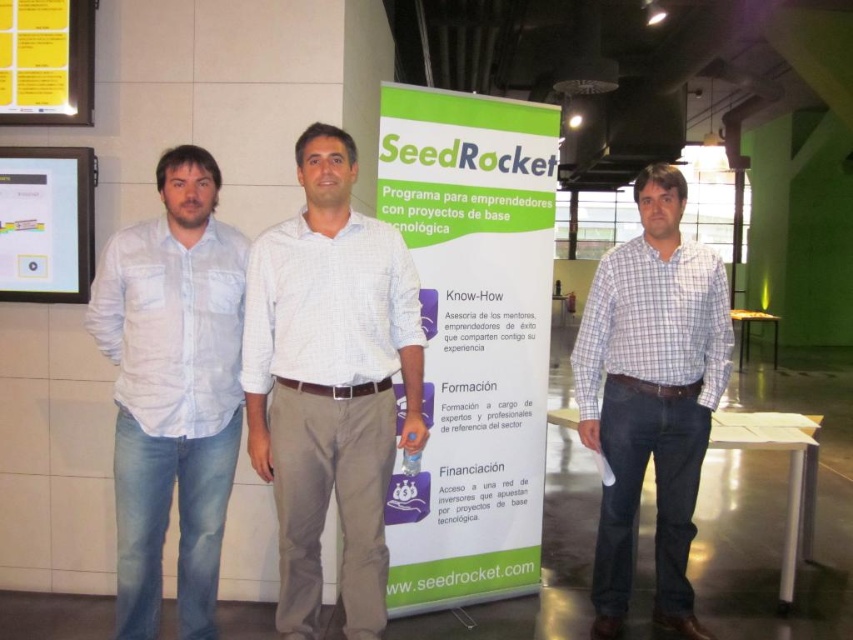
Between light blue cotton shirt at left and checkered fabric shirt at center, which one is positioned lower?

checkered fabric shirt at center

Can you confirm if light blue cotton shirt at left is positioned to the right of checkered fabric shirt at center?

In fact, light blue cotton shirt at left is to the left of checkered fabric shirt at center.

Which is behind, point (97, 310) or point (670, 502)?

The point (670, 502) is behind.

At what (x,y) coordinates should I click in order to perform the action: click on light blue cotton shirt at left. Please return your answer as a coordinate pair (x, y). Image resolution: width=853 pixels, height=640 pixels. Looking at the image, I should click on (172, 388).

Which is more to the left, white checkered shirt at center or light blue cotton shirt at left?

From the viewer's perspective, light blue cotton shirt at left appears more on the left side.

Is white checkered shirt at center bigger than light blue cotton shirt at left?

No.

In order to click on white checkered shirt at center in this screenshot , I will do `click(329, 381)`.

Where is `white checkered shirt at center`? white checkered shirt at center is located at coordinates (329, 381).

Can you confirm if light blue cotton shirt at left is thinner than matte plastic screen at left?

In fact, light blue cotton shirt at left might be wider than matte plastic screen at left.

Which is in front, point (117, 552) or point (80, 180)?

Point (117, 552) is more forward.

The image size is (853, 640). Find the location of `light blue cotton shirt at left`. light blue cotton shirt at left is located at coordinates (172, 388).